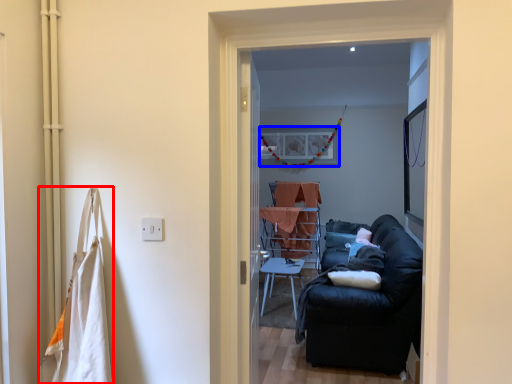
Question: Which of the following is the farthest to the observer, laundry (highlighted by a red box) or picture frame (highlighted by a blue box)?

Choices:
 (A) laundry
 (B) picture frame

Answer: (B)